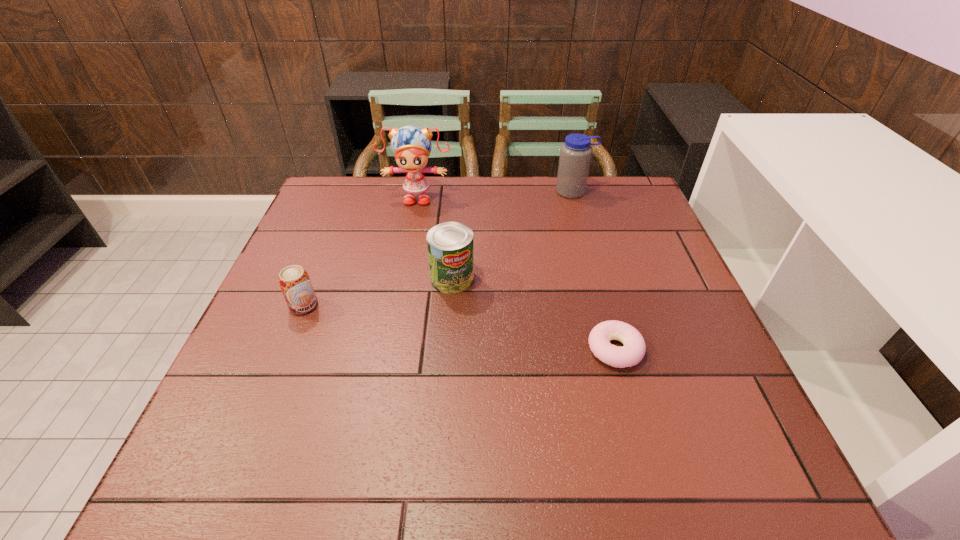
Identify the location of vacant region located on the back of the third farthest object. The height and width of the screenshot is (540, 960). (456, 226).

Where is `free space located 0.130m on the right of the leftmost object`? The width and height of the screenshot is (960, 540). free space located 0.130m on the right of the leftmost object is located at coordinates (374, 306).

Locate an element on the screen. Image resolution: width=960 pixels, height=540 pixels. vacant space situated on the right of the nearest object is located at coordinates (719, 349).

The width and height of the screenshot is (960, 540). I want to click on doll located in the far edge section of the desktop, so click(x=411, y=145).

Where is `water bottle that is positioned at the far edge`? The image size is (960, 540). water bottle that is positioned at the far edge is located at coordinates (575, 154).

Where is `object present at the left edge`? object present at the left edge is located at coordinates (294, 281).

Locate an element on the screen. This screenshot has width=960, height=540. water bottle located in the right edge section of the desktop is located at coordinates (575, 154).

Find the location of a particular element. This screenshot has height=540, width=960. doughnut that is at the right edge is located at coordinates (633, 351).

You are a GUI agent. You are given a task and a screenshot of the screen. Output one action in this format:
    pyautogui.click(x=<x>, y=<y>)
    Task: Click on the object that is at the far right corner
    
    Given the screenshot: What is the action you would take?
    pyautogui.click(x=575, y=154)

Image resolution: width=960 pixels, height=540 pixels. Find the location of `vacant area at the far edge`. vacant area at the far edge is located at coordinates (518, 216).